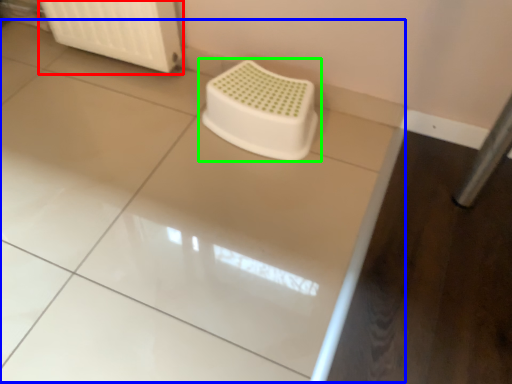
Question: Which object is the farthest from radiator (highlighted by a red box)? Choose among these: counter top (highlighted by a blue box) or toilet (highlighted by a green box).

Choices:
 (A) counter top
 (B) toilet

Answer: (A)